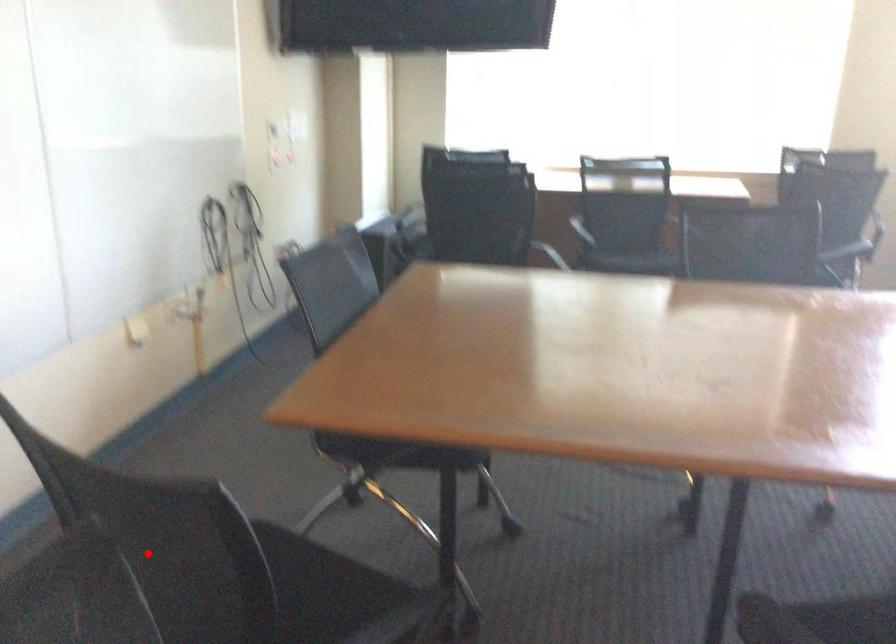
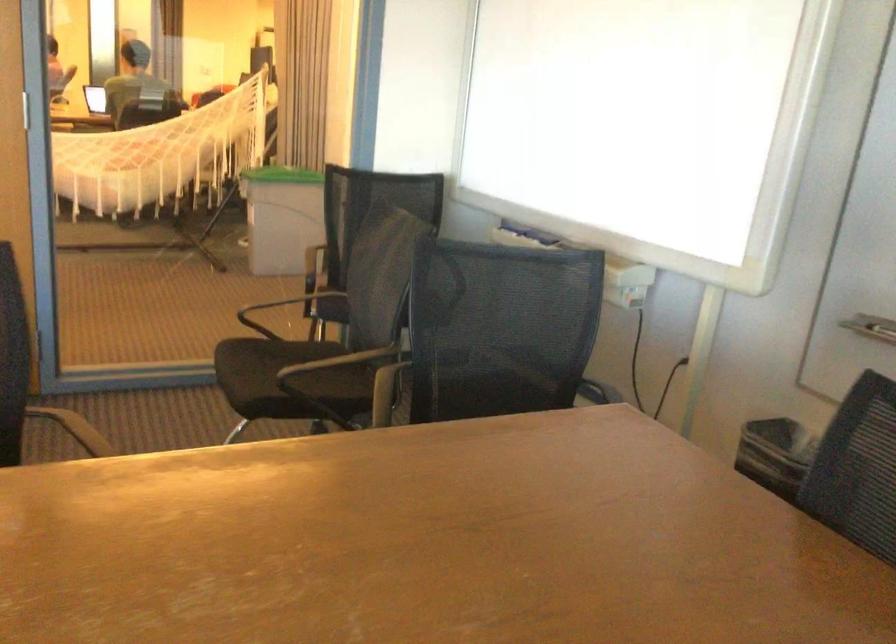
Question: I am providing you with two images of the same scene from different viewpoints. Image1 has a red point marked. In image2, the corresponding 3D location appears at what relative position? Reply with the corresponding letter.

Choices:
 (A) Closer
 (B) Farther

Answer: (B)